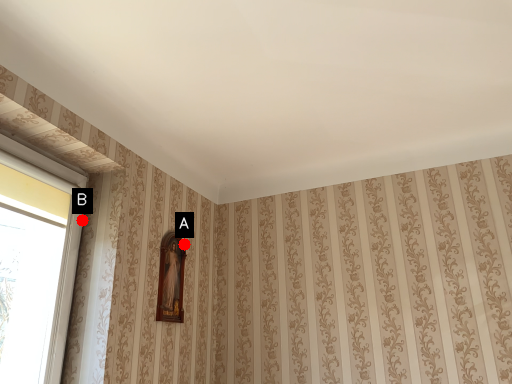
Question: Two points are circled on the image, labeled by A and B beside each circle. Which point is closer to the camera taking this photo?

Choices:
 (A) A is closer
 (B) B is closer

Answer: (B)